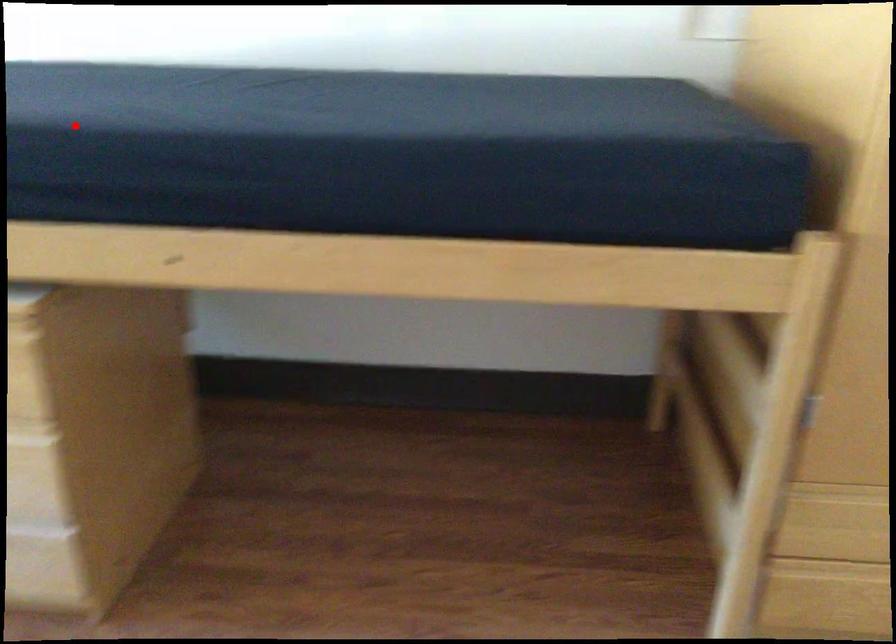
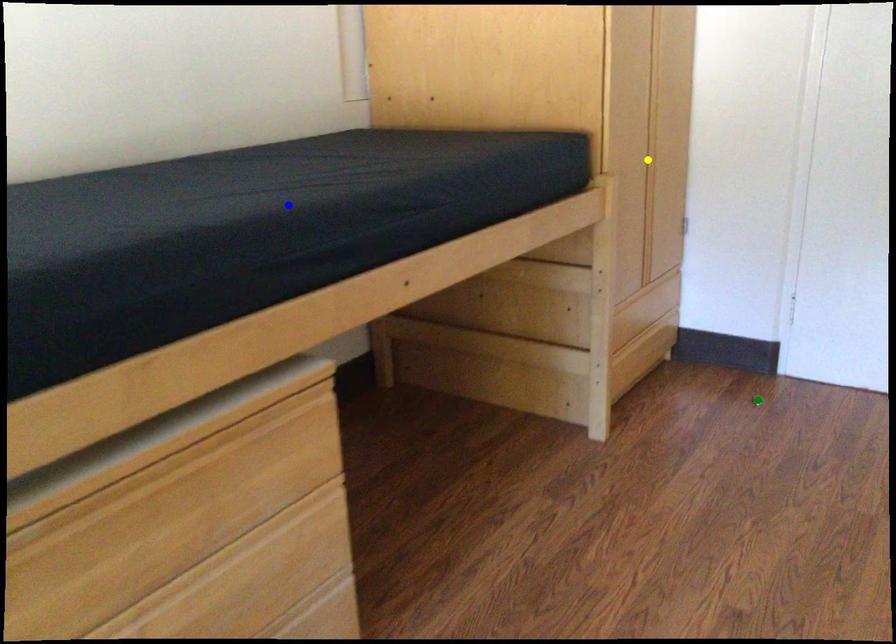
Question: I am providing you with two images of the same scene from different viewpoints. A red point is marked on the first image. You are given multiple points on the second image. Which spot in image 2 lines up with the point in image 1?

Choices:
 (A) yellow point
 (B) blue point
 (C) green point

Answer: (B)